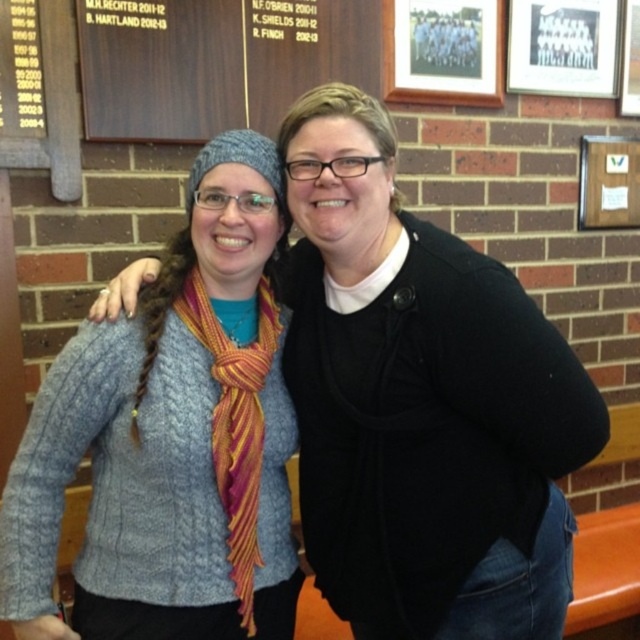
You are a photographer adjusting your camera settings to focus on the knitted blue sweater at center and the knitted gray sweater at center. Which sweater should you focus on first to ensure the closest one is sharp?

The knitted blue sweater at center is closer to the viewer than the knitted gray sweater at center, so focus on the knitted blue sweater at center first to ensure it is sharp.

You are a photographer trying to capture a closeup of the knitted gray sweater at center and the knitted wool scarf at center. Since you want to focus on both items clearly, do you think you can adjust your camera to have both in focus without moving the camera or the subjects?

The knitted gray sweater at center might be wider than knitted wool scarf at center, so it depends on the camera settings and distance. If the depth of field is sufficient to cover both items given their width difference, then yes, but if not, you might need to adjust aperture or focus on a midpoint.